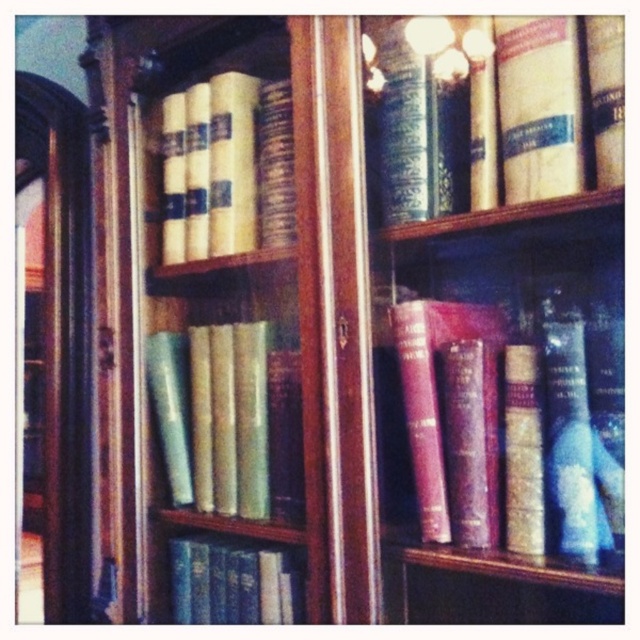
Question: Which object appears farthest from the camera in this image?

Choices:
 (A) maroon leather book at center
 (B) yellowish matte book at upper left
 (C) hardcover book at center

Answer: (B)

Question: Which of the following is the farthest from the observer?

Choices:
 (A) (246, 134)
 (B) (289, 609)
 (C) (179, 406)
 (D) (529, 321)

Answer: (C)

Question: Does hardcover book at upper center appear on the left side of green leather book at center?

Choices:
 (A) yes
 (B) no

Answer: (B)

Question: Can you confirm if maroon leather book at center is positioned to the right of green leather book at center?

Choices:
 (A) no
 (B) yes

Answer: (B)

Question: Does maroon leather book at center have a larger size compared to yellowish matte book at upper left?

Choices:
 (A) no
 (B) yes

Answer: (B)

Question: Among these points, which one is nearest to the camera?

Choices:
 (A) (177, 548)
 (B) (412, 141)

Answer: (B)